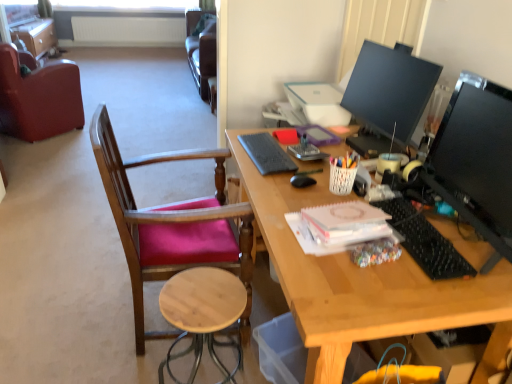
Locate an element on the screen. vacant space situated on the left part of wooden chair with pink cushion at left, the 2th chair viewed from the top is located at coordinates point(61,320).